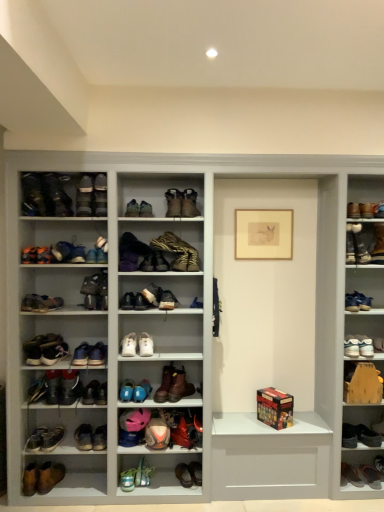
What do you see at coordinates (132, 209) in the screenshot? I see `leather boot at center, the twelfth footwear viewed from the left` at bounding box center [132, 209].

What do you see at coordinates (37, 390) in the screenshot?
I see `shiny black shoes at lower left, arranged as the first footwear when viewed from the left` at bounding box center [37, 390].

The height and width of the screenshot is (512, 384). What do you see at coordinates (356, 245) in the screenshot?
I see `brown suede boot at right, which is the 22th footwear in left-to-right order` at bounding box center [356, 245].

Find the location of a particular element. The width and height of the screenshot is (384, 512). brown suede boot at right, the 11th footwear from the right is located at coordinates (356, 245).

Identify the location of leather boot at center, the twelfth footwear viewed from the left. This screenshot has height=512, width=384. (132, 209).

Consider the image. Is leather boots at center, which is the twentieth footwear in right-to-left order, thinner than white leather sneaker at center, placed as the 17th footwear when sorted from right to left?

Correct, the width of leather boots at center, which is the twentieth footwear in right-to-left order, is less than that of white leather sneaker at center, placed as the 17th footwear when sorted from right to left.

Considering the sizes of objects leather boots at center, marked as the thirteenth footwear in a left-to-right arrangement, and white leather sneaker at center, which is counted as the 16th footwear, starting from the left, in the image provided, who is bigger, leather boots at center, marked as the thirteenth footwear in a left-to-right arrangement, or white leather sneaker at center, which is counted as the 16th footwear, starting from the left,?

leather boots at center, marked as the thirteenth footwear in a left-to-right arrangement.

From a real-world perspective, is leather boots at center, marked as the thirteenth footwear in a left-to-right arrangement, positioned above or below white leather sneaker at center, placed as the 17th footwear when sorted from right to left?

From a real-world perspective, leather boots at center, marked as the thirteenth footwear in a left-to-right arrangement, is physically above white leather sneaker at center, placed as the 17th footwear when sorted from right to left.

From the image's perspective, is leather boots at center, marked as the thirteenth footwear in a left-to-right arrangement, located above or below white leather sneaker at center, placed as the 17th footwear when sorted from right to left?

Based on their image positions, leather boots at center, marked as the thirteenth footwear in a left-to-right arrangement, is located above white leather sneaker at center, placed as the 17th footwear when sorted from right to left.

Who is bigger, white leather shoe at center, which appears as the third shoe when ordered from the bottom, or leather sneaker at upper left, the 13th shoe positioned from the bottom?

With larger size is leather sneaker at upper left, the 13th shoe positioned from the bottom.

In the image, is white leather shoe at center, the eleventh shoe in the top-to-bottom sequence, positioned in front of or behind leather sneaker at upper left, marked as the first shoe in a top-to-bottom arrangement?

Visually, white leather shoe at center, the eleventh shoe in the top-to-bottom sequence, is located behind leather sneaker at upper left, marked as the first shoe in a top-to-bottom arrangement.

From a real-world perspective, is white leather shoe at center, which appears as the third shoe when ordered from the bottom, over leather sneaker at upper left, marked as the first shoe in a top-to-bottom arrangement?

No.

Does white leather shoe at center, which appears as the third shoe when ordered from the bottom, appear on the right side of leather sneaker at upper left, marked as the first shoe in a top-to-bottom arrangement?

Yes.

Is point (78, 206) closer to viewer compared to point (95, 249)?

Yes, it is in front of point (95, 249).

Which shoe is the 2nd one when counting from the left side of the white leather sneaker at center, the eighth shoe from the top? Please provide its 2D coordinates.

[(84, 197)]

Is white leather sneaker at center, positioned as the 6th shoe in bottom-to-top order, completely or partially inside leather boot at upper left, which is the 2th shoe from top to bottom?

That's incorrect, white leather sneaker at center, positioned as the 6th shoe in bottom-to-top order, is not inside leather boot at upper left, which is the 2th shoe from top to bottom.

Which of these two, leather boot at upper left, which is the 2th shoe from top to bottom, or white leather sneaker at center, the eighth shoe from the top, stands shorter?

white leather sneaker at center, the eighth shoe from the top.

Which point is more forward, (199, 300) or (162, 443)?

The point (162, 443) is closer to the camera.

Is leather boot at center, marked as the 12th footwear in a right-to-left arrangement, oriented away from matte pink leather shoe at lower center, the 1th shoe in the bottom-to-top sequence?

No, leather boot at center, marked as the 12th footwear in a right-to-left arrangement, is not facing away from matte pink leather shoe at lower center, the 1th shoe in the bottom-to-top sequence.

Does leather boot at center, acting as the 21th footwear starting from the left, contain matte pink leather shoe at lower center, the 13th shoe from the top?

No, matte pink leather shoe at lower center, the 13th shoe from the top, is not a part of leather boot at center, acting as the 21th footwear starting from the left.

Does leather boot at center, acting as the 21th footwear starting from the left, have a lesser width compared to matte pink leather shoe at lower center, the 1th shoe in the bottom-to-top sequence?

Yes.

From a real-world perspective, count 1st footwears downward from the shiny teal sneakers at lower center, the 25th footwear viewed from the right, and point to it. Please provide its 2D coordinates.

[(184, 475)]

Is shiny teal sneakers at lower center, arranged as the 8th footwear when viewed from the left, directly adjacent to brown leather shoe at lower center, the twentieth footwear viewed from the left?

shiny teal sneakers at lower center, arranged as the 8th footwear when viewed from the left, and brown leather shoe at lower center, the twentieth footwear viewed from the left, are not in contact.

From a real-world perspective, who is located higher, shiny teal sneakers at lower center, the 25th footwear viewed from the right, or brown leather shoe at lower center, the twentieth footwear viewed from the left?

In real-world perspective, shiny teal sneakers at lower center, the 25th footwear viewed from the right, is above.

Is matte pink leather shoe at lower center, the 1th shoe in the bottom-to-top sequence, thinner than white leather sneakers at right, the 5th footwear from the right?

No, matte pink leather shoe at lower center, the 1th shoe in the bottom-to-top sequence, is not thinner than white leather sneakers at right, the 5th footwear from the right.

Is matte pink leather shoe at lower center, the 13th shoe from the top, looking in the opposite direction of white leather sneakers at right, the 5th footwear from the right?

Result: No.

Is matte pink leather shoe at lower center, the 1th shoe in the bottom-to-top sequence, at the left side of white leather sneakers at right, the 5th footwear from the right?

Correct, you'll find matte pink leather shoe at lower center, the 1th shoe in the bottom-to-top sequence, to the left of white leather sneakers at right, the 5th footwear from the right.

Consider the image. What's the angular difference between matte pink leather shoe at lower center, the 1th shoe in the bottom-to-top sequence, and white leather sneakers at right, the 5th footwear from the right,'s facing directions?

The angle between the facing direction of matte pink leather shoe at lower center, the 1th shoe in the bottom-to-top sequence, and the facing direction of white leather sneakers at right, the 5th footwear from the right, is 5.44 degrees.

Considering the positions of objects leather sneakers at left, marked as the 31th footwear in a right-to-left arrangement, and leather snakeskin boot at center, the fifteenth footwear from the right, in the image provided, who is behind, leather sneakers at left, marked as the 31th footwear in a right-to-left arrangement, or leather snakeskin boot at center, the fifteenth footwear from the right,?

Positioned behind is leather snakeskin boot at center, the fifteenth footwear from the right.

Who is smaller, leather sneakers at left, the 2th footwear when ordered from left to right, or leather snakeskin boot at center, the fifteenth footwear from the right?

leather sneakers at left, the 2th footwear when ordered from left to right, is smaller.

From the picture: How different are the orientations of leather sneakers at left, marked as the 31th footwear in a right-to-left arrangement, and leather snakeskin boot at center, the fifteenth footwear from the right, in degrees?

The facing directions of leather sneakers at left, marked as the 31th footwear in a right-to-left arrangement, and leather snakeskin boot at center, the fifteenth footwear from the right, are 28.2 degrees apart.

Which of these two, leather sneakers at left, marked as the 31th footwear in a right-to-left arrangement, or leather snakeskin boot at center, the fifteenth footwear from the right, stands shorter?

Standing shorter between the two is leather sneakers at left, marked as the 31th footwear in a right-to-left arrangement.

From the image's perspective, count 5th footwears upward from the white leather sneaker at center, which is counted as the 16th footwear, starting from the left, and point to it. Please provide its 2D coordinates.

[(131, 252)]

Where is `the 10th shoe behind the leather sneaker at upper left, the 13th shoe positioned from the bottom`? This screenshot has width=384, height=512. the 10th shoe behind the leather sneaker at upper left, the 13th shoe positioned from the bottom is located at coordinates point(141,302).

Looking at this image, which object lies nearer to the anchor point white leather sneaker at lower left, positioned as the fourth footwear in left-to-right order, white leather sneaker at center, which is counted as the 16th footwear, starting from the left, or white leather shoe at center, the fourth shoe in the bottom-to-top sequence?

The object closer to white leather sneaker at lower left, positioned as the fourth footwear in left-to-right order, is white leather shoe at center, the fourth shoe in the bottom-to-top sequence.

Which object lies further to the anchor point matte brown boot at right, which is the 24th footwear from left to right, leather boots at center, which is the twentieth footwear in right-to-left order, or brown suede boot at right, the 11th footwear from the right?

leather boots at center, which is the twentieth footwear in right-to-left order, is further to matte brown boot at right, which is the 24th footwear from left to right.

Which object lies nearer to the anchor point white leather sneaker at lower left, positioned as the fourth footwear in left-to-right order, matte black sneaker at left, marked as the fifth shoe in a top-to-bottom arrangement, or white matte shoe rack at center?

matte black sneaker at left, marked as the fifth shoe in a top-to-bottom arrangement, lies closer to white leather sneaker at lower left, positioned as the fourth footwear in left-to-right order, than the other object.

Estimate the real-world distances between objects in this image. Which object is further from brown leather shoes at lower left, acting as the 30th footwear starting from the right, leather boot at center, the twelfth footwear viewed from the left, or matte pink leather shoe at lower center, the 13th shoe from the top?

leather boot at center, the twelfth footwear viewed from the left, is further to brown leather shoes at lower left, acting as the 30th footwear starting from the right.

Looking at the image, which one is located further to white leather shoe at center, marked as the 18th footwear in a right-to-left arrangement, white leather sneaker at lower left, positioned as the fourth footwear in left-to-right order, or blue suede shoes at lower center, the 24th footwear positioned from the right?

white leather sneaker at lower left, positioned as the fourth footwear in left-to-right order, is further to white leather shoe at center, marked as the 18th footwear in a right-to-left arrangement.

Considering their positions, is white leather sneakers at center, the 23th footwear in the right-to-left sequence, positioned further to white leather sneakers at center, acting as the 22th footwear starting from the right, than leather boots at center, which is the twentieth footwear in right-to-left order?

Based on the image, leather boots at center, which is the twentieth footwear in right-to-left order, appears to be further to white leather sneakers at center, acting as the 22th footwear starting from the right.

When comparing their distances from white leather sneaker at center, the fifth shoe when ordered from bottom to top, does leather sneakers at left, marked as the 31th footwear in a right-to-left arrangement, or matte black sneaker at left, marked as the fifth shoe in a top-to-bottom arrangement, seem closer?

The object closer to white leather sneaker at center, the fifth shoe when ordered from bottom to top, is matte black sneaker at left, marked as the fifth shoe in a top-to-bottom arrangement.

Which object lies further to the anchor point leather boot at center, which is the first footwear from right to left, brown leather shoe at lower center, the twentieth footwear viewed from the left, or brown leather boot at center, the 14th footwear positioned from the right?

brown leather boot at center, the 14th footwear positioned from the right, is further to leather boot at center, which is the first footwear from right to left.

What are the coordinates of `shelf between brown suede boot at center, which is the 17th footwear from left to right, and brown leather boot at lower left, the 26th footwear viewed from the right, vertically` in the screenshot? It's located at (172, 333).

This screenshot has height=512, width=384. In order to click on picture frame situated between brown leather shoes at lower left, arranged as the 3th footwear when viewed from the left, and brown suede boot at lower right, marked as the 31th footwear in a left-to-right arrangement, from left to right in this screenshot , I will do `click(263, 234)`.

At what (x,y) coordinates should I click in order to perform the action: click on shelf between white leather sneaker at center, the eighth shoe from the top, and shiny teal sneakers at lower center, arranged as the 8th footwear when viewed from the left, in the up-down direction. Please return your answer as a coordinate pair (x, y). Looking at the image, I should click on (172, 333).

Identify the location of shelf between leather sneaker at upper left, marked as the first shoe in a top-to-bottom arrangement, and white leather sneakers at right, the 5th footwear from the right. (172, 333).